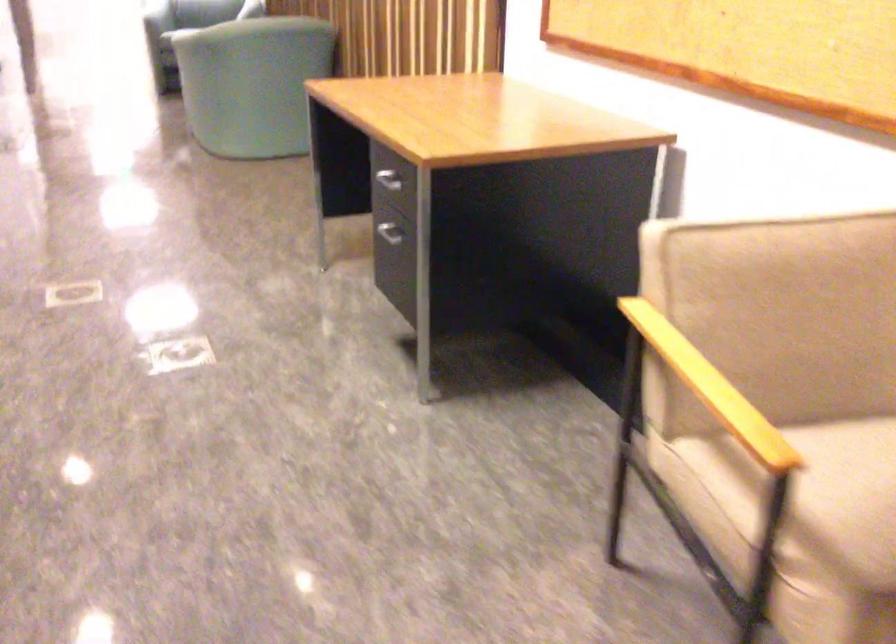
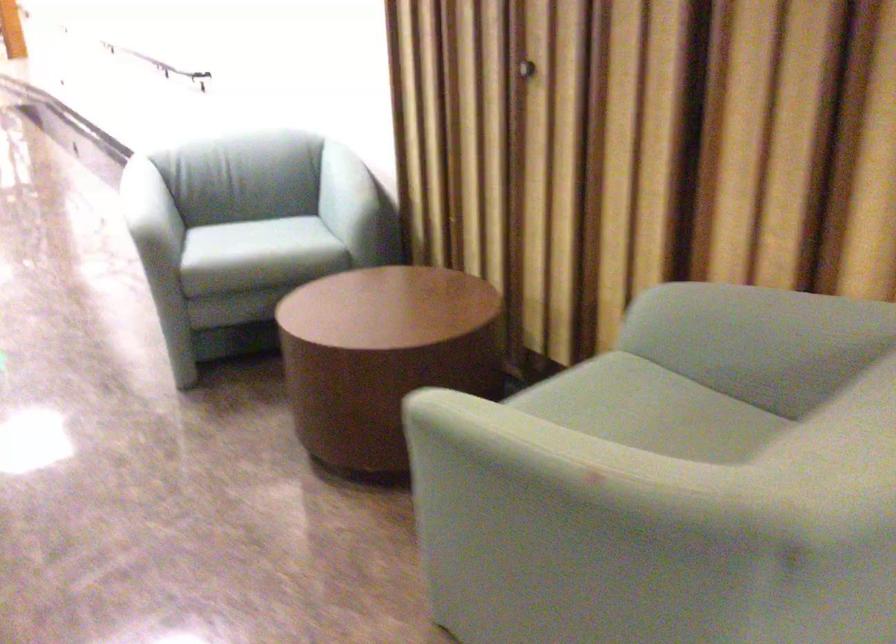
Which direction would the cameraman need to move to produce the second image?

The cameraman walked toward left, forward.